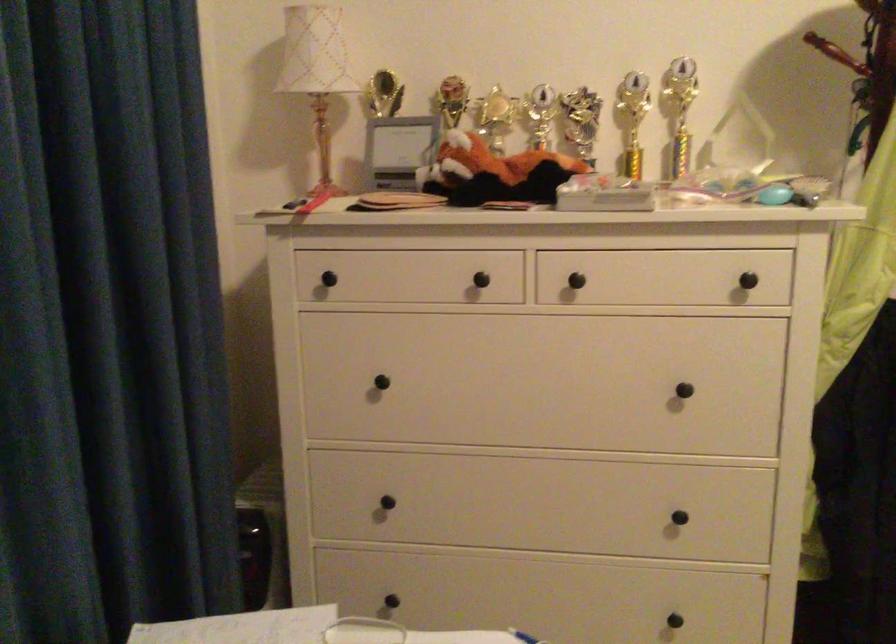
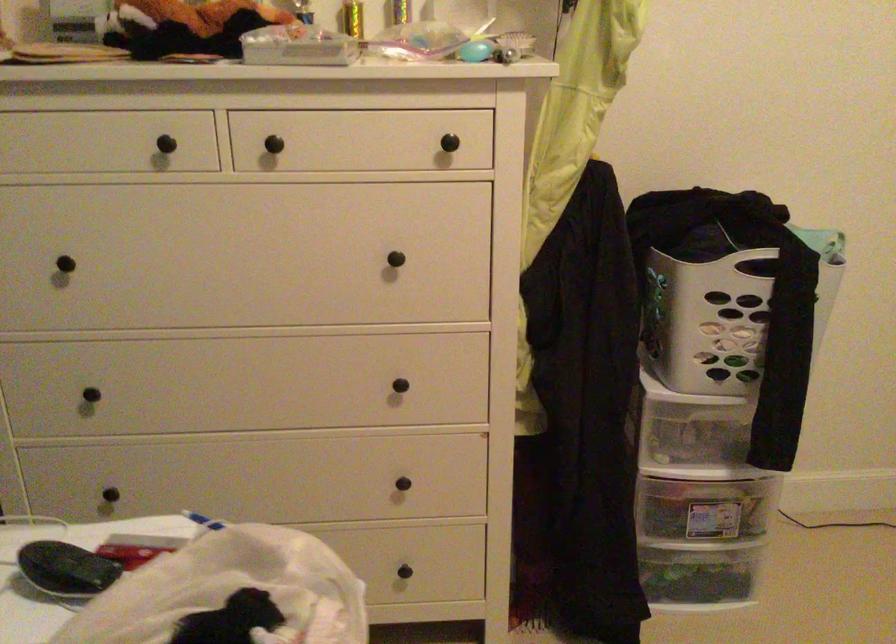
Locate, in the second image, the point that corresponds to [691,395] in the first image.

(400, 261)